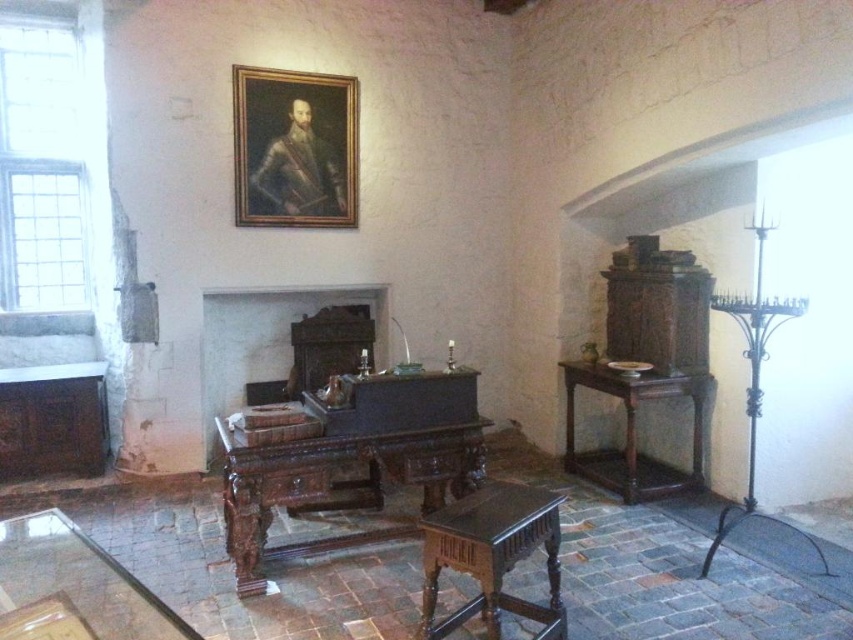
Does dark brown wood stool at center have a lesser height compared to dark wood fireplace at center?

Indeed, dark brown wood stool at center has a lesser height compared to dark wood fireplace at center.

Which is more to the right, dark brown wood stool at center or dark wood fireplace at center?

dark brown wood stool at center

Is point (492, 484) less distant than point (276, 392)?

Yes, point (492, 484) is closer to viewer.

Find the location of a particular element. The height and width of the screenshot is (640, 853). dark brown wood stool at center is located at coordinates (492, 556).

Does dark wood fireplace at center have a greater width compared to translucent glass table at lower left?

Correct, the width of dark wood fireplace at center exceeds that of translucent glass table at lower left.

Who is more forward, (216, 332) or (24, 584)?

Point (24, 584) is more forward.

Between point (279, 348) and point (57, 563), which one is positioned in front?

Point (57, 563) is in front.

At what (x,y) coordinates should I click in order to perform the action: click on dark wood fireplace at center. Please return your answer as a coordinate pair (x, y). The height and width of the screenshot is (640, 853). Looking at the image, I should click on (265, 340).

Can you confirm if dark wood carved table at center is positioned above dark wood fireplace at center?

No.

This screenshot has height=640, width=853. What do you see at coordinates (334, 483) in the screenshot? I see `dark wood carved table at center` at bounding box center [334, 483].

Locate an element on the screen. The image size is (853, 640). dark wood carved table at center is located at coordinates (334, 483).